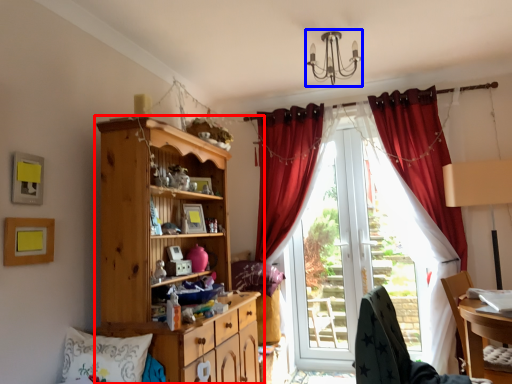
Question: Which point is closer to the camera, cabinetry (highlighted by a red box) or light fixture (highlighted by a blue box)?

Choices:
 (A) cabinetry
 (B) light fixture

Answer: (A)